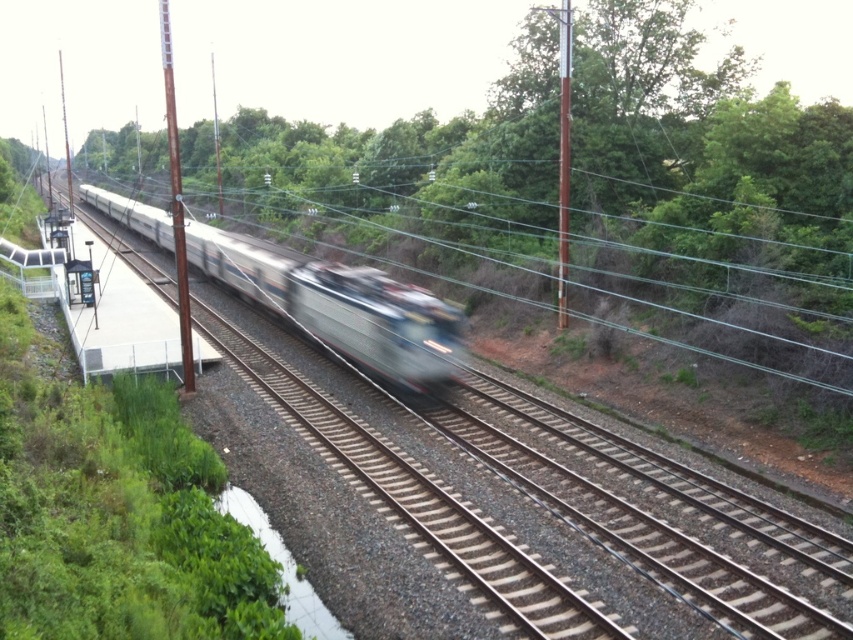
Looking at this image, is silver metallic train at center to the right of metallic pole at upper right from the viewer's perspective?

In fact, silver metallic train at center is to the left of metallic pole at upper right.

Find the location of a particular element. silver metallic train at center is located at coordinates [x=340, y=305].

From the picture: Is metal/smooth train tracks at center to the left of metallic pole at upper right from the viewer's perspective?

Indeed, metal/smooth train tracks at center is positioned on the left side of metallic pole at upper right.

Does metal/smooth train tracks at center have a smaller size compared to metallic pole at upper right?

No, metal/smooth train tracks at center is not smaller than metallic pole at upper right.

Who is more forward, (x=311, y=381) or (x=558, y=38)?

Point (x=311, y=381) is in front.

This screenshot has width=853, height=640. Identify the location of metal/smooth train tracks at center. (520, 499).

Who is more forward, (448, 346) or (171, 108)?

Point (171, 108)

Is point (231, 237) positioned before point (170, 172)?

Yes, point (231, 237) is in front of point (170, 172).

Find the location of a particular element. silver metallic train at center is located at coordinates (340, 305).